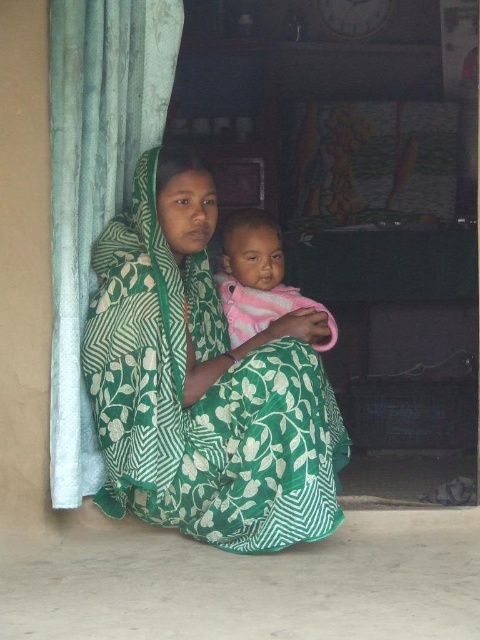
You are trying to determine if the green printed fabric at center can cover the pink soft fabric baby at center completely. Based on their sizes, is this possible?

The green printed fabric at center might be wider than pink soft fabric baby at center, so it is possible that the green printed fabric at center could cover the pink soft fabric baby at center completely if its dimensions are sufficient in both width and length.